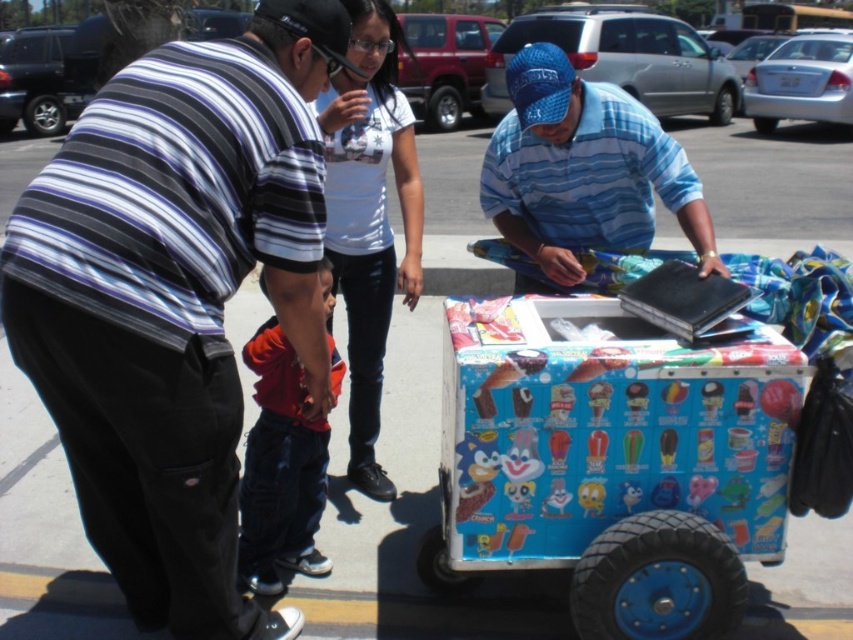
Consider the image. You are standing on the sidewalk and see the blue plastic wagon at lower center. If you want to reach it without moving, can you touch it with your outstretched hand?

The blue plastic wagon at lower center is 2.49 meters away from the viewer, so it is too far to touch with an outstretched hand.

You are a customer at the ice cream cart. You have a blue plastic wagon at lower center and a white matte shirt at upper center in your view. Which object is bigger?

The blue plastic wagon at lower center is larger in size than the white matte shirt at upper center.

You are a delivery person who needs to place a package on the white matte shirt at upper center. However, there is a blue plastic wagon at lower center in the way. Can you easily move the wagon to access the shirt?

The blue plastic wagon at lower center is closer to the viewer than the white matte shirt at upper center, so you would need to move the wagon out of the way to access the shirt. However, since the wagon is closer, you can move it aside to make space for placing the package on the white matte shirt at upper center.